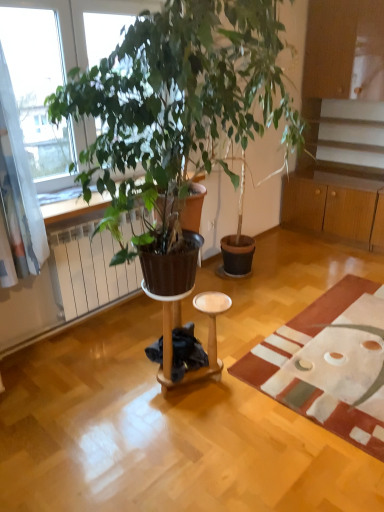
I want to click on empty space that is ontop of textured beige rug at lower right, so pos(340,338).